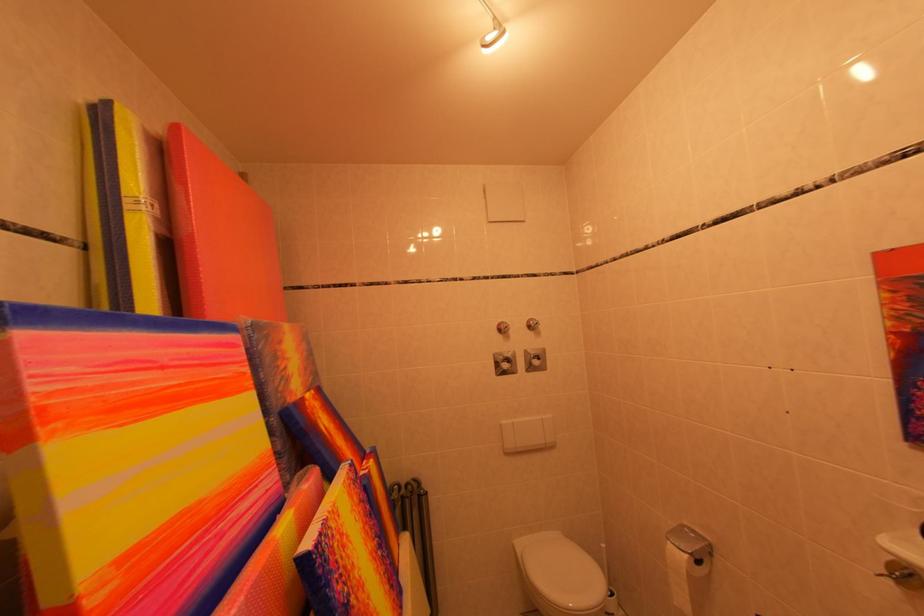
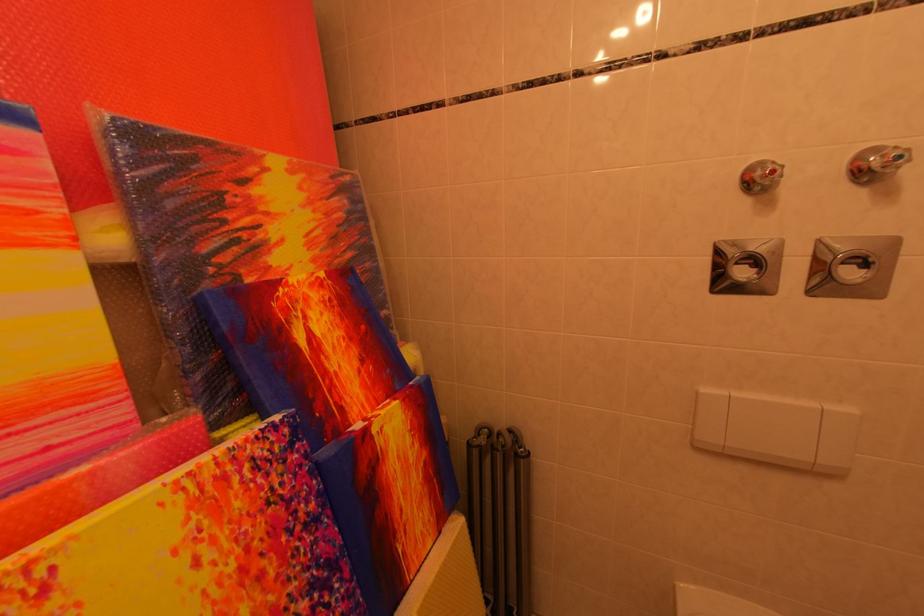
Locate, in the second image, the point that corresponds to point 378,537 in the first image.

(281, 575)